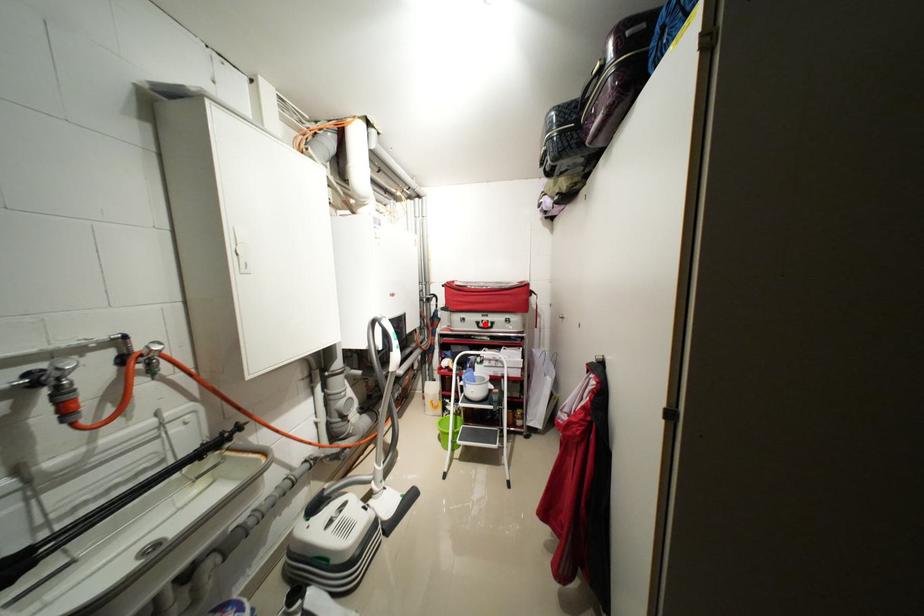
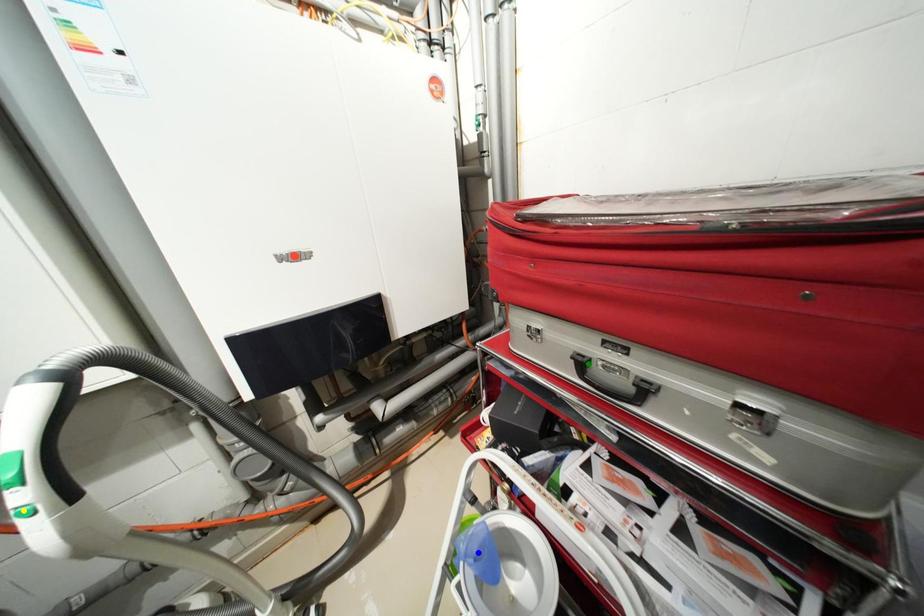
Question: I am providing you with two images of the same scene from different viewpoints. A red point is marked on the first image. You are given multiple points on the second image. Which spot in image 2 lines up with the point in image 1?

Choices:
 (A) yellow point
 (B) green point
 (C) blue point

Answer: (B)